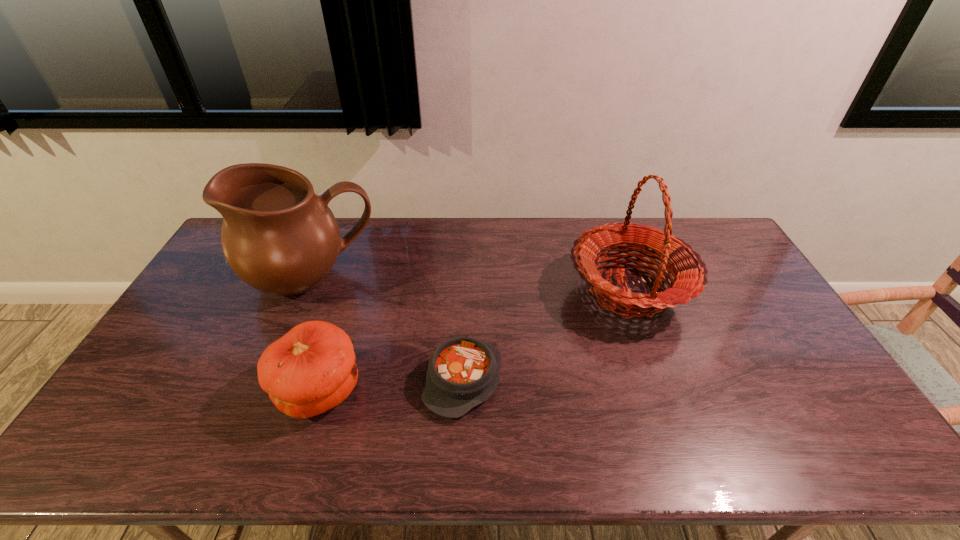
In order to click on free space that satisfies the following two spatial constraints: 1. at the spout of the casserole; 2. on the right side of the cream pitcher in this screenshot , I will do `click(270, 380)`.

The image size is (960, 540). In order to click on free point that satisfies the following two spatial constraints: 1. at the spout of the cream pitcher; 2. on the left side of the basket in this screenshot , I will do `click(306, 292)`.

This screenshot has width=960, height=540. What are the coordinates of `vacant region that satisfies the following two spatial constraints: 1. at the spout of the cream pitcher; 2. on the left side of the rightmost object` in the screenshot? It's located at (306, 292).

What are the coordinates of `vacant space that satisfies the following two spatial constraints: 1. on the back side of the third tallest object; 2. on the left side of the shortest object` in the screenshot? It's located at (324, 380).